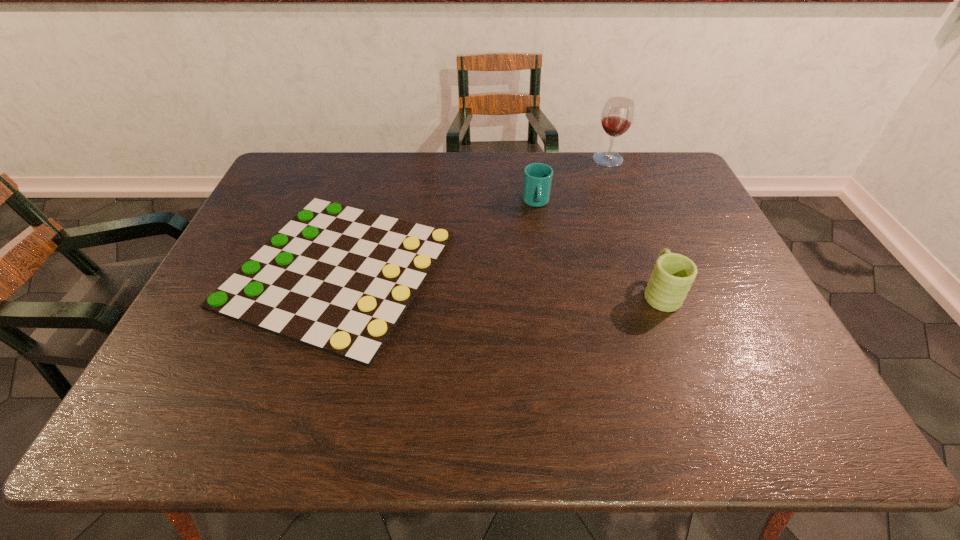
I want to click on free space located 0.270m on the handle side of the cup, so click(x=547, y=279).

Identify the location of free location located on the front of the shortest object. The image size is (960, 540). (298, 397).

This screenshot has height=540, width=960. What are the coordinates of `object at the far edge` in the screenshot? It's located at (617, 116).

This screenshot has height=540, width=960. Find the location of `object that is positioned at the left edge`. object that is positioned at the left edge is located at coordinates (338, 279).

At what (x,y) coordinates should I click in order to perform the action: click on vacant space at the far edge of the desktop. Please return your answer as a coordinate pair (x, y). The height and width of the screenshot is (540, 960). Looking at the image, I should click on click(x=413, y=179).

In the image, there is a desktop. Where is `vacant space at the near edge`? vacant space at the near edge is located at coordinates (635, 401).

In the image, there is a desktop. Find the location of `vacant space at the left edge`. vacant space at the left edge is located at coordinates (195, 322).

In the image, there is a desktop. At what (x,y) coordinates should I click in order to perform the action: click on free region at the far right corner. Please return your answer as a coordinate pair (x, y). This screenshot has height=540, width=960. Looking at the image, I should click on (650, 153).

At what (x,y) coordinates should I click in order to perform the action: click on unoccupied area between the mug and the tallest object. Please return your answer as a coordinate pair (x, y). The height and width of the screenshot is (540, 960). Looking at the image, I should click on (635, 226).

At what (x,y) coordinates should I click in order to perform the action: click on vacant space in between the tallest object and the leftmost object. Please return your answer as a coordinate pair (x, y). The width and height of the screenshot is (960, 540). Looking at the image, I should click on (473, 214).